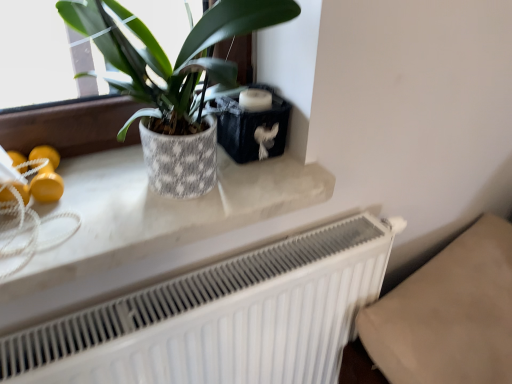
Identify the location of blank area beneath textured ceramic pot at upper left (from a real-world perspective). (152, 191).